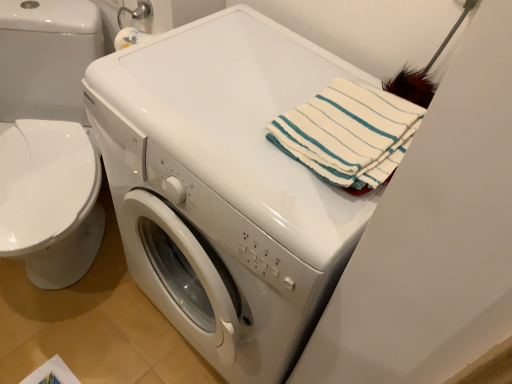
Locate an element on the screen. The height and width of the screenshot is (384, 512). free location to the left of white striped towel at upper right is located at coordinates (233, 124).